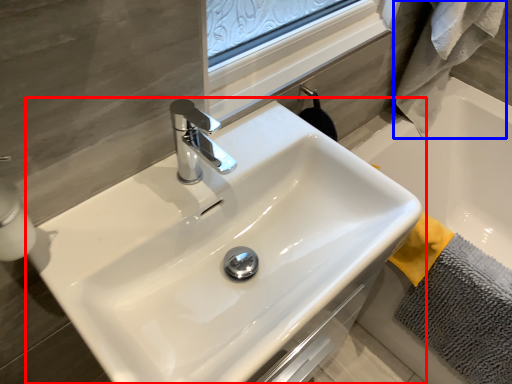
Question: Which object appears closest to the camera in this image, sink (highlighted by a red box) or bath towel (highlighted by a blue box)?

Choices:
 (A) sink
 (B) bath towel

Answer: (A)